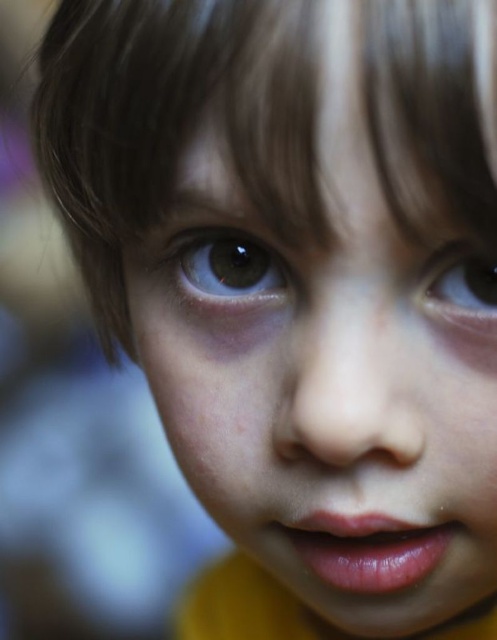
Can you confirm if brown glossy eye at center is positioned above brown glossy eye at upper right?

Correct, brown glossy eye at center is located above brown glossy eye at upper right.

Where is `brown glossy eye at center`? This screenshot has height=640, width=497. brown glossy eye at center is located at coordinates (229, 268).